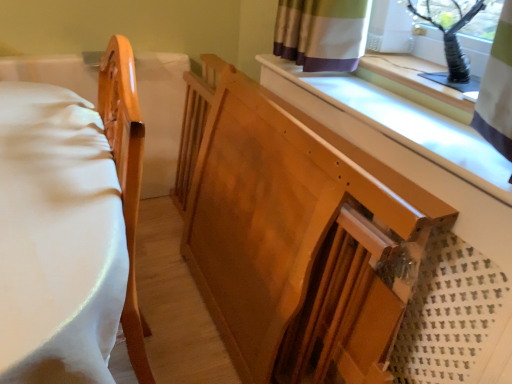
Question: Which is correct: wooden changing table at center is inside matte wood bed frame at left, or outside of it?

Choices:
 (A) outside
 (B) inside

Answer: (A)

Question: From a real-world perspective, relative to matte wood bed frame at left, is wooden changing table at center vertically above or below?

Choices:
 (A) above
 (B) below

Answer: (B)

Question: Which is nearer to the wooden changing table at center?

Choices:
 (A) matte wood bed frame at left
 (B) black plastic vase at upper right

Answer: (A)

Question: Which is farther from the wooden changing table at center?

Choices:
 (A) black plastic vase at upper right
 (B) matte wood bed frame at left

Answer: (A)